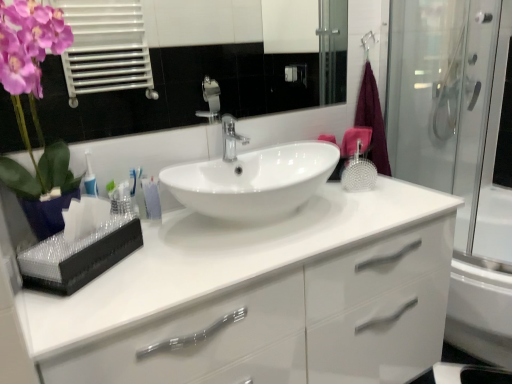
Question: Can you confirm if transparent glass shower door at right is taller than maroon fabric bath towel at right?

Choices:
 (A) yes
 (B) no

Answer: (A)

Question: Considering the relative sizes of transparent glass shower door at right and maroon fabric bath towel at right in the image provided, is transparent glass shower door at right thinner than maroon fabric bath towel at right?

Choices:
 (A) no
 (B) yes

Answer: (A)

Question: Does transparent glass shower door at right appear on the left side of maroon fabric bath towel at right?

Choices:
 (A) yes
 (B) no

Answer: (B)

Question: From the image's perspective, is transparent glass shower door at right on maroon fabric bath towel at right?

Choices:
 (A) no
 (B) yes

Answer: (B)

Question: Is transparent glass shower door at right to the right of maroon fabric bath towel at right from the viewer's perspective?

Choices:
 (A) yes
 (B) no

Answer: (A)

Question: In terms of size, does white glossy sink at center appear bigger or smaller than maroon fabric bath towel at right?

Choices:
 (A) big
 (B) small

Answer: (A)

Question: From their relative heights in the image, would you say white glossy sink at center is taller or shorter than maroon fabric bath towel at right?

Choices:
 (A) short
 (B) tall

Answer: (A)

Question: From the image's perspective, is white glossy sink at center above or below maroon fabric bath towel at right?

Choices:
 (A) above
 (B) below

Answer: (B)

Question: Visually, is white glossy sink at center positioned to the left or to the right of maroon fabric bath towel at right?

Choices:
 (A) right
 (B) left

Answer: (B)

Question: Is transparent glass shower door at right in front of or behind polished chrome faucet at center in the image?

Choices:
 (A) front
 (B) behind

Answer: (A)

Question: Is point 450,94 positioned closer to the camera than point 230,117?

Choices:
 (A) closer
 (B) farther

Answer: (B)

Question: Is transparent glass shower door at right to the left or to the right of polished chrome faucet at center in the image?

Choices:
 (A) left
 (B) right

Answer: (B)

Question: Is transparent glass shower door at right spatially inside polished chrome faucet at center, or outside of it?

Choices:
 (A) outside
 (B) inside

Answer: (A)

Question: In the image, is translucent plastic toothbrushes at left positioned in front of or behind glossy ceramic mirror at upper center?

Choices:
 (A) behind
 (B) front

Answer: (A)

Question: Based on their sizes in the image, would you say translucent plastic toothbrushes at left is bigger or smaller than glossy ceramic mirror at upper center?

Choices:
 (A) big
 (B) small

Answer: (B)